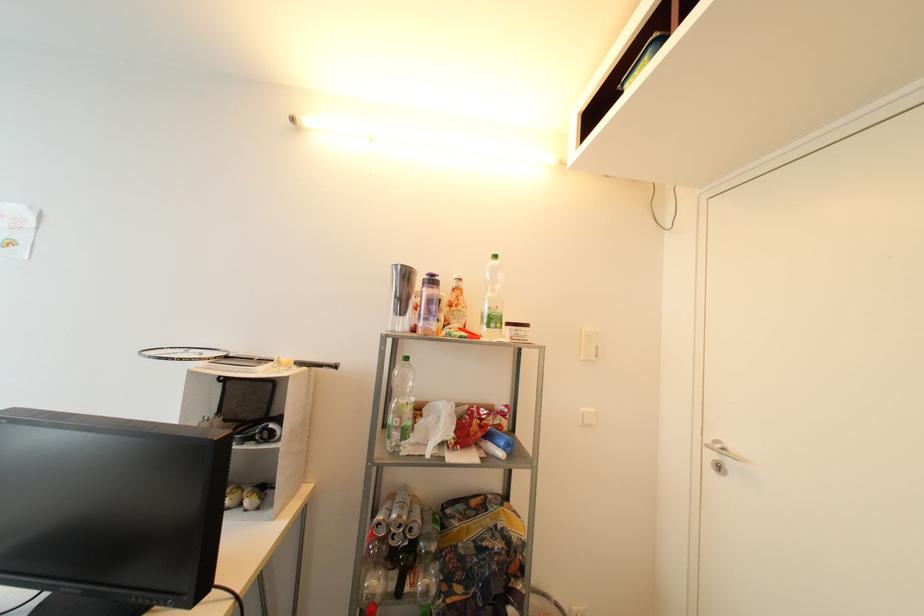
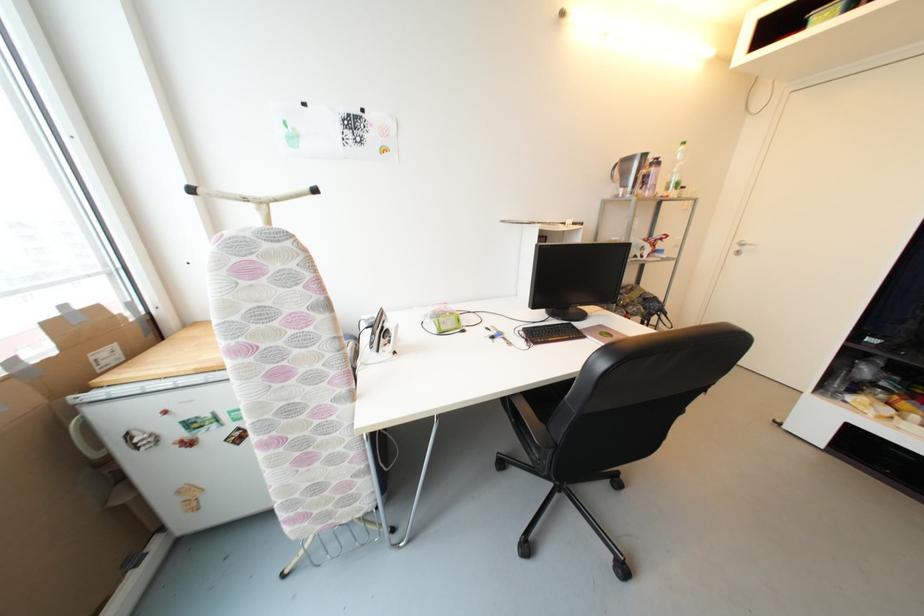
The point at (716, 456) is marked in the first image. Where is the corresponding point in the second image?

(742, 249)